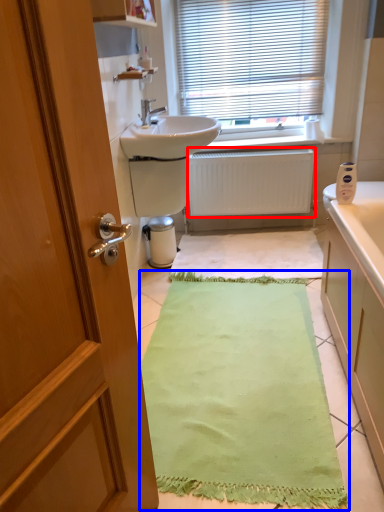
Question: Among these objects, which one is nearest to the camera, radiator (highlighted by a red box) or bath mat (highlighted by a blue box)?

Choices:
 (A) radiator
 (B) bath mat

Answer: (B)